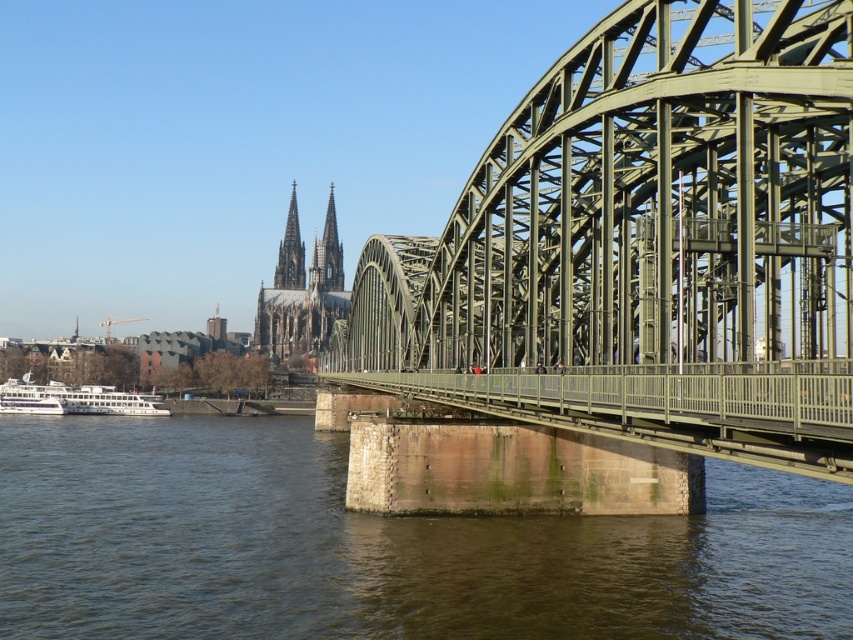
You are standing on the Hohenzollern Bridge in Cologne, Germany. You see the green stone cathedral at center and the smooth stone spire at center. Which one is closer to you?

Both the green stone cathedral at center and the smooth stone spire at center are actually the same structure. The spire is part of the cathedral, so they are at the same distance from you.

You are a tourist standing on the Hohenzollern Bridge in Cologne, Germany. You see the brown stone river at center and the smooth gray stone spire at upper center. How far apart are these two landmarks?

The brown stone river at center is 258.16 meters from the smooth gray stone spire at upper center.